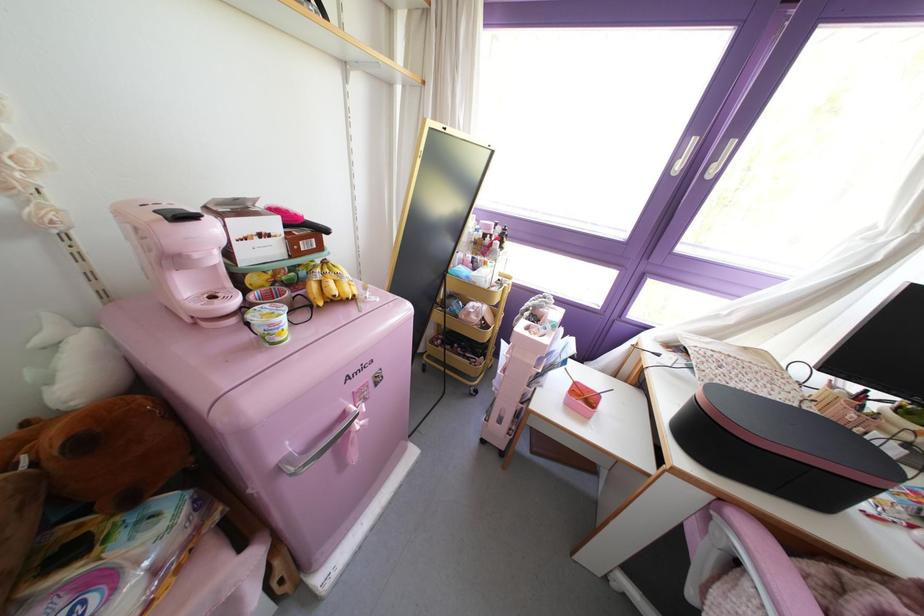
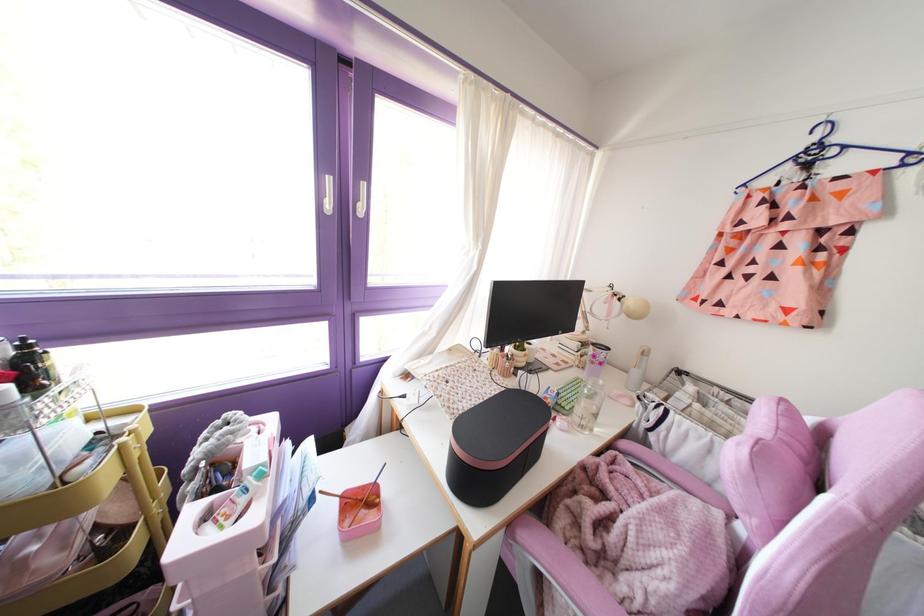
Locate, in the second image, the point that corresponds to point 507,277 in the first image.

(130, 411)